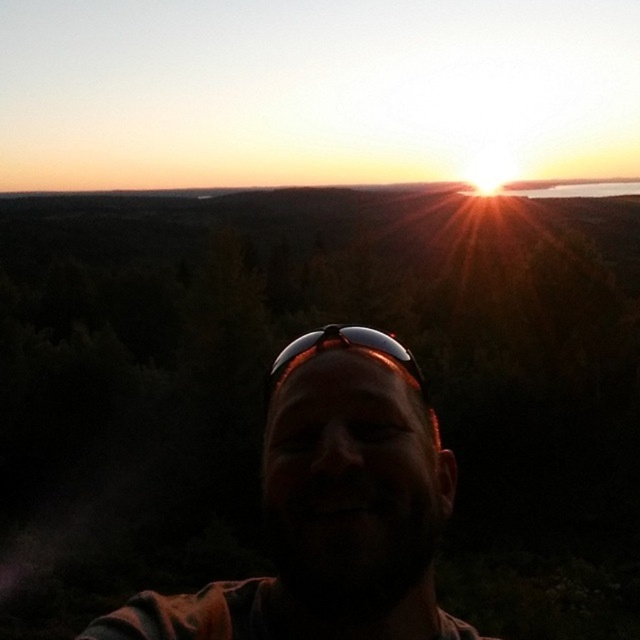
What do you see at coordinates (332, 508) in the screenshot? The height and width of the screenshot is (640, 640). I see `matte black sunglasses at center` at bounding box center [332, 508].

The image size is (640, 640). I want to click on matte black sunglasses at center, so click(332, 508).

Where is `matte black sunglasses at center`? Image resolution: width=640 pixels, height=640 pixels. matte black sunglasses at center is located at coordinates (332, 508).